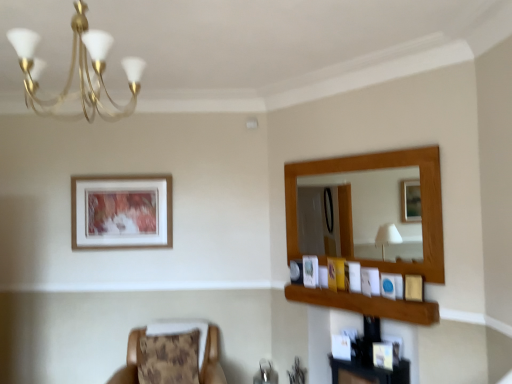
Locate an element on the screen. vacant space to the left of matte blue picture frame at upper right, the fifth picture frame positioned from the back is located at coordinates (376, 295).